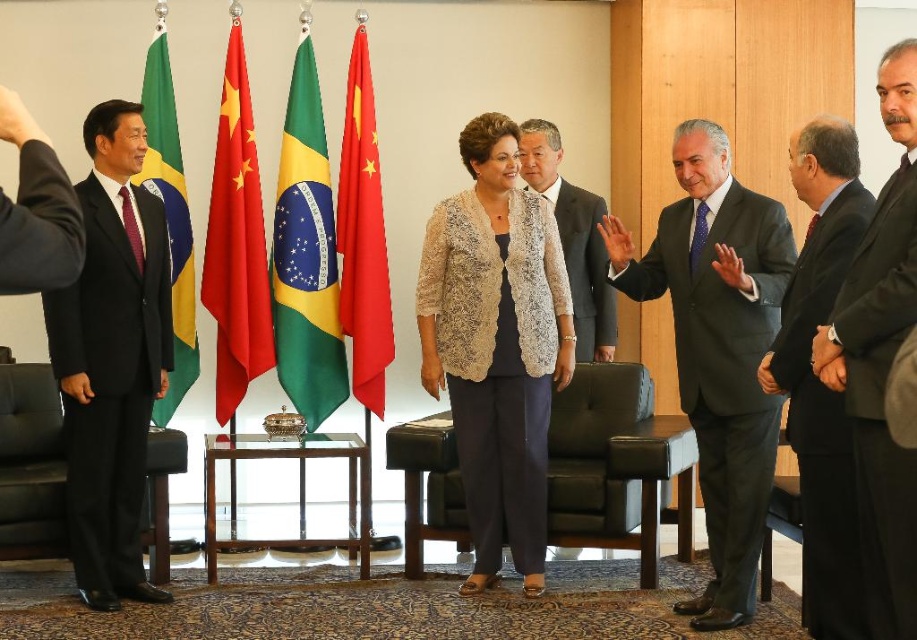
Question: Among these points, which one is nearest to the camera?

Choices:
 (A) (511, 252)
 (B) (360, 275)

Answer: (A)

Question: Which of the following is the farthest from the observer?

Choices:
 (A) green fabric flag at center
 (B) green fabric flag at left
 (C) dark gray suit at center

Answer: (A)

Question: Which object is closer to the camera taking this photo?

Choices:
 (A) green fabric flag at left
 (B) dark gray suit at center

Answer: (B)

Question: From the image, what is the correct spatial relationship of dark gray suit at right in relation to green fabric flag at left?

Choices:
 (A) above
 (B) below

Answer: (B)

Question: Is red fabric flag at center positioned behind green fabric flag at left?

Choices:
 (A) yes
 (B) no

Answer: (A)

Question: Is red fabric flag at center positioned in front of light beige textured blazer at center?

Choices:
 (A) yes
 (B) no

Answer: (B)